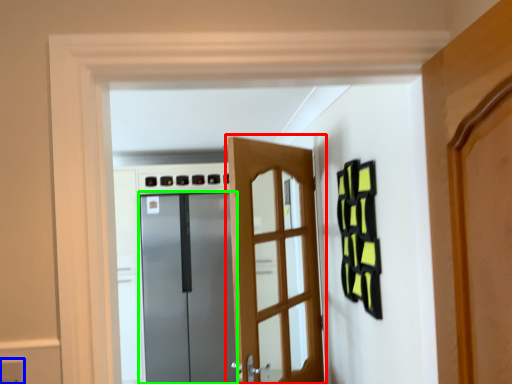
Question: Estimate the real-world distances between objects in this image. Which object is closer to door (highlighted by a red box), electric outlet (highlighted by a blue box) or door (highlighted by a green box)?

Choices:
 (A) electric outlet
 (B) door

Answer: (A)